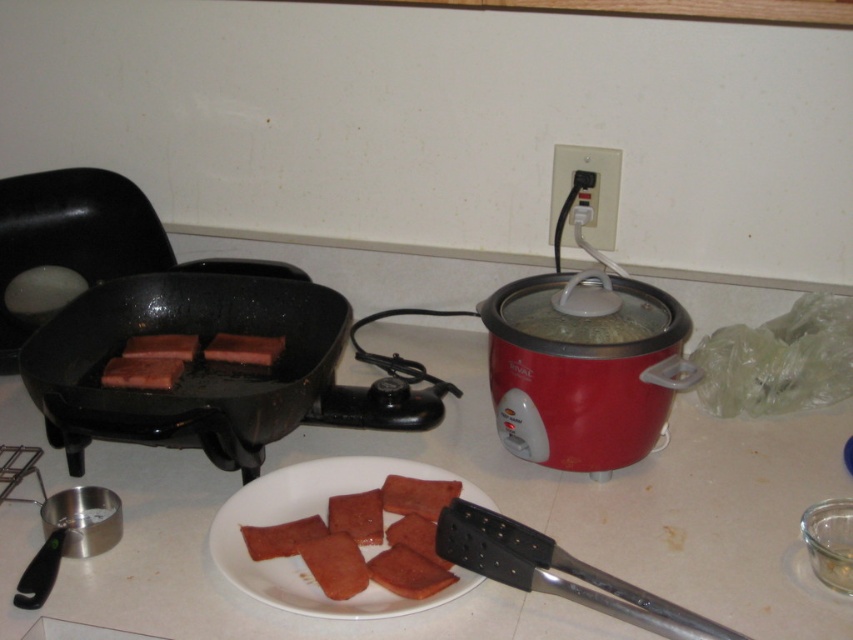
Does point (271, 412) come in front of point (404, 465)?

Yes.

The image size is (853, 640). Find the location of `black non-stick frying pan at center`. black non-stick frying pan at center is located at coordinates (186, 364).

The height and width of the screenshot is (640, 853). Describe the element at coordinates (186, 364) in the screenshot. I see `black non-stick frying pan at center` at that location.

Where is `black non-stick frying pan at center`? The width and height of the screenshot is (853, 640). black non-stick frying pan at center is located at coordinates (186, 364).

Can you confirm if slightly crispy pinkish-brown ham at center is taller than brown matte ham at center?

No, slightly crispy pinkish-brown ham at center is not taller than brown matte ham at center.

Locate an element on the screen. The width and height of the screenshot is (853, 640). slightly crispy pinkish-brown ham at center is located at coordinates (408, 572).

The height and width of the screenshot is (640, 853). In order to click on slightly crispy pinkish-brown ham at center in this screenshot , I will do `click(408, 572)`.

Can you confirm if red matte rice cooker at right is positioned above brown matte ham at center?

Yes, red matte rice cooker at right is above brown matte ham at center.

Does red matte rice cooker at right appear under brown matte ham at center?

Actually, red matte rice cooker at right is above brown matte ham at center.

The height and width of the screenshot is (640, 853). What do you see at coordinates (583, 372) in the screenshot?
I see `red matte rice cooker at right` at bounding box center [583, 372].

Where is `red matte rice cooker at right`? This screenshot has height=640, width=853. red matte rice cooker at right is located at coordinates (583, 372).